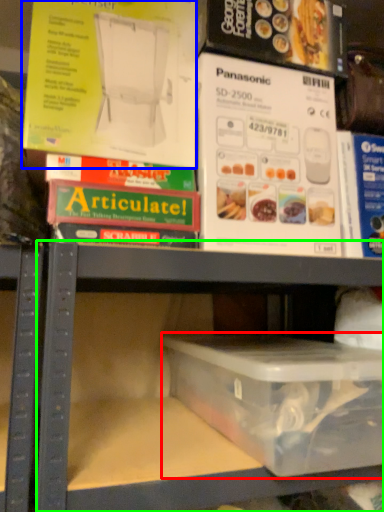
Question: Which object is the closest to the box (highlighted by a red box)? Choose among these: paperback book (highlighted by a blue box) or shelf (highlighted by a green box).

Choices:
 (A) paperback book
 (B) shelf

Answer: (B)